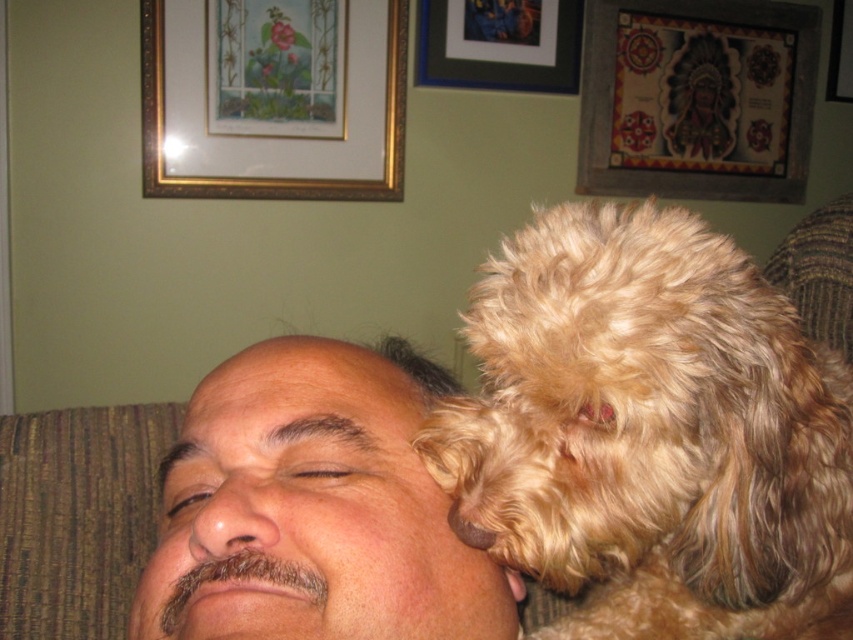
Please look at the coordinates provided. Which object is located at point (653, 433)?

The point (653, 433) indicates fuzzy golden dog at upper right.